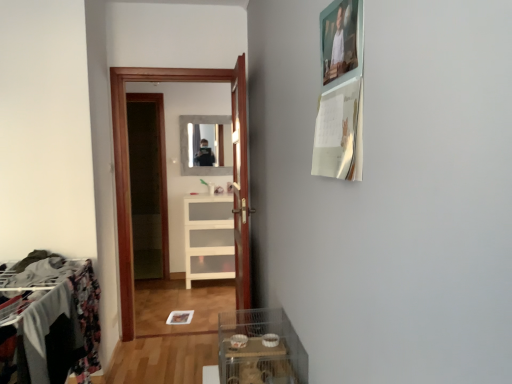
Question: Would you say metallic wire rack at left is to the left or to the right of wooden door at center in the picture?

Choices:
 (A) right
 (B) left

Answer: (B)

Question: Is point (67, 331) positioned closer to the camera than point (233, 235)?

Choices:
 (A) farther
 (B) closer

Answer: (B)

Question: Which of these objects is positioned closest to the wooden door at center?

Choices:
 (A) white glossy cabinet at center
 (B) matte glass mirror at center
 (C) transparent plastic container at lower center
 (D) white glossy cabinet at center
 (E) metallic wire rack at left

Answer: (C)

Question: Estimate the real-world distances between objects in this image. Which object is closer to the white glossy cabinet at center?

Choices:
 (A) white glossy cabinet at center
 (B) wooden door at center
 (C) transparent plastic container at lower center
 (D) metallic wire rack at left
 (E) matte glass mirror at center

Answer: (B)